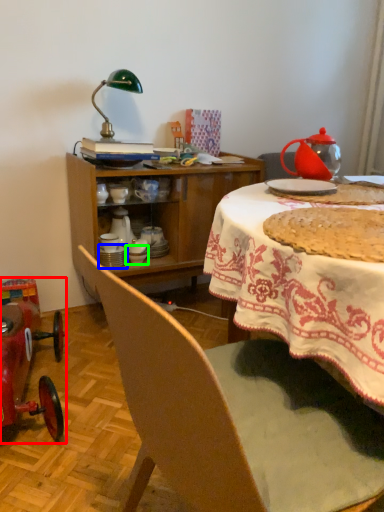
Question: Which object is positioned farthest from model car (highlighted by a red box)? Select from tableware (highlighted by a blue box) and tableware (highlighted by a green box).

Choices:
 (A) tableware
 (B) tableware

Answer: (B)